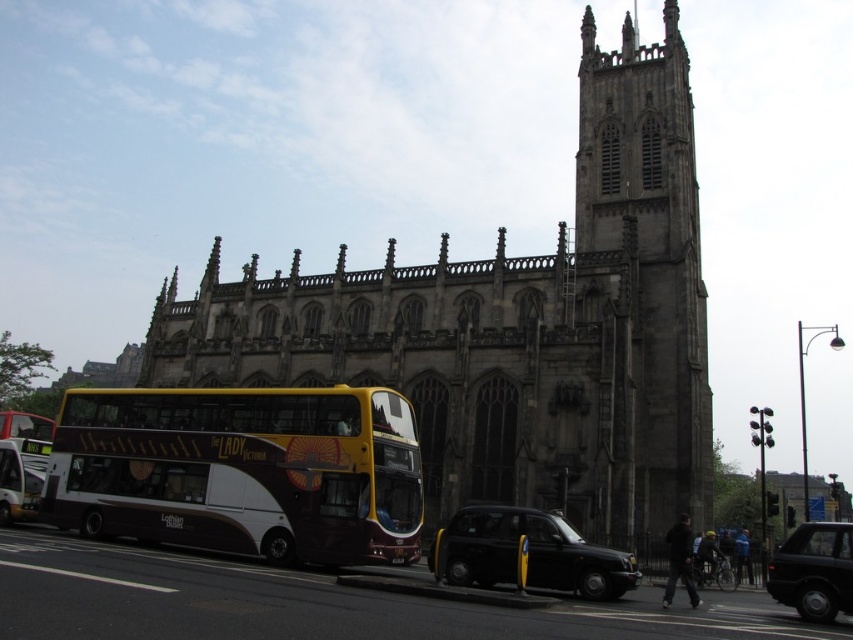
You are a tourist standing in the middle of the street. You want to take a photo of the dark gray stone tower at center and the black matte taxi at center. Which object should you focus on first to ensure it appears larger in your photo?

The dark gray stone tower at center is closer to you than the black matte taxi at center, so focusing on it first will make it appear larger in the photo.